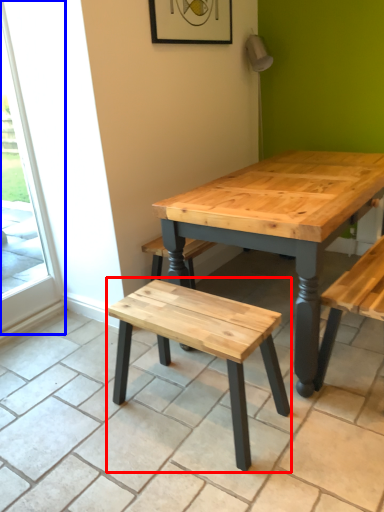
Question: Which of the following is the closest to the observer, stool (highlighted by a red box) or screen door (highlighted by a blue box)?

Choices:
 (A) stool
 (B) screen door

Answer: (A)